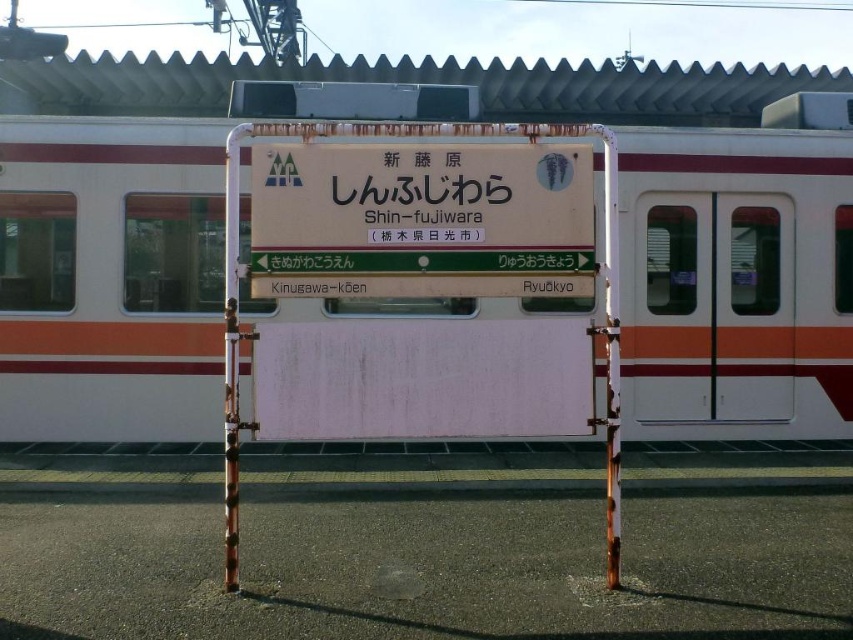
Can you confirm if white matte train at center is thinner than matte white sign at center?

Incorrect, white matte train at center's width is not less than matte white sign at center's.

Which of these two, white matte train at center or matte white sign at center, stands shorter?

matte white sign at center

The height and width of the screenshot is (640, 853). Identify the location of white matte train at center. (109, 278).

Find the location of `white matte train at center`. white matte train at center is located at coordinates (109, 278).